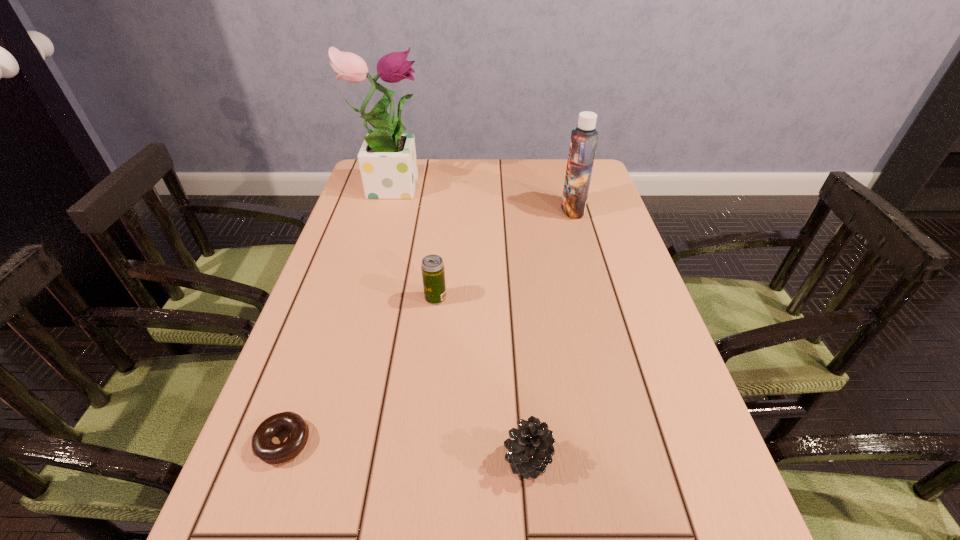
Where is `free space between the third object from right to left and the second tallest object`? The width and height of the screenshot is (960, 540). free space between the third object from right to left and the second tallest object is located at coordinates (504, 254).

This screenshot has height=540, width=960. In order to click on free space between the second tallest object and the flower arrangement in this screenshot , I will do `click(482, 197)`.

Find the location of a particular element. vacant area that lies between the third nearest object and the pinecone is located at coordinates (482, 379).

Choose which object is the second nearest neighbor to the tallest object. Please provide its 2D coordinates. Your answer should be formatted as a tuple, i.e. [(x, y)], where the tuple contains the x and y coordinates of a point satisfying the conditions above.

[(583, 142)]

You are a GUI agent. You are given a task and a screenshot of the screen. Output one action in this format:
    pyautogui.click(x=<x>, y=<y>)
    Task: Click on the object that is the third nearest to the doughnut
    This screenshot has width=960, height=540.
    Given the screenshot: What is the action you would take?
    (x=387, y=159)

At what (x,y) coordinates should I click in order to perform the action: click on blank area in the image that satisfies the following two spatial constraints: 1. on the front side of the doughnut; 2. on the right side of the fourth object from left to right. Please return your answer as a coordinate pair (x, y). This screenshot has width=960, height=540. Looking at the image, I should click on (276, 459).

Image resolution: width=960 pixels, height=540 pixels. What are the coordinates of `free space that satisfies the following two spatial constraints: 1. on the front-facing side of the tallest object; 2. on the left side of the third object from left to right` in the screenshot? It's located at (358, 298).

Where is `blank area in the image that satisfies the following two spatial constraints: 1. on the front-facing side of the flower arrangement; 2. on the left side of the third object from left to right`? blank area in the image that satisfies the following two spatial constraints: 1. on the front-facing side of the flower arrangement; 2. on the left side of the third object from left to right is located at coordinates (358, 298).

Find the location of `vacant space that satisfies the following two spatial constraints: 1. on the back side of the beer can; 2. on the front-facing side of the flower arrangement`. vacant space that satisfies the following two spatial constraints: 1. on the back side of the beer can; 2. on the front-facing side of the flower arrangement is located at coordinates (447, 185).

The height and width of the screenshot is (540, 960). I want to click on free point that satisfies the following two spatial constraints: 1. on the back side of the third object from right to left; 2. on the front-facing side of the flower arrangement, so click(x=447, y=185).